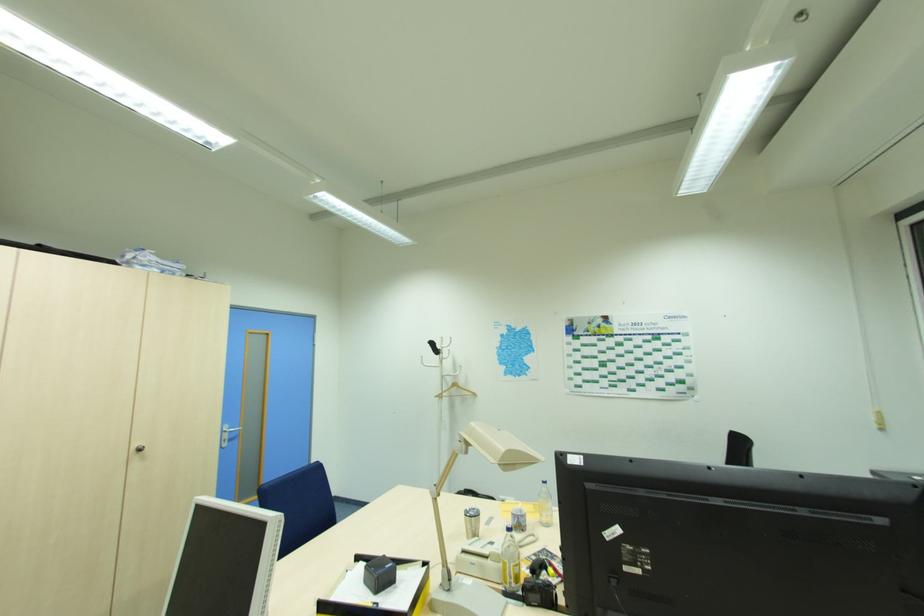
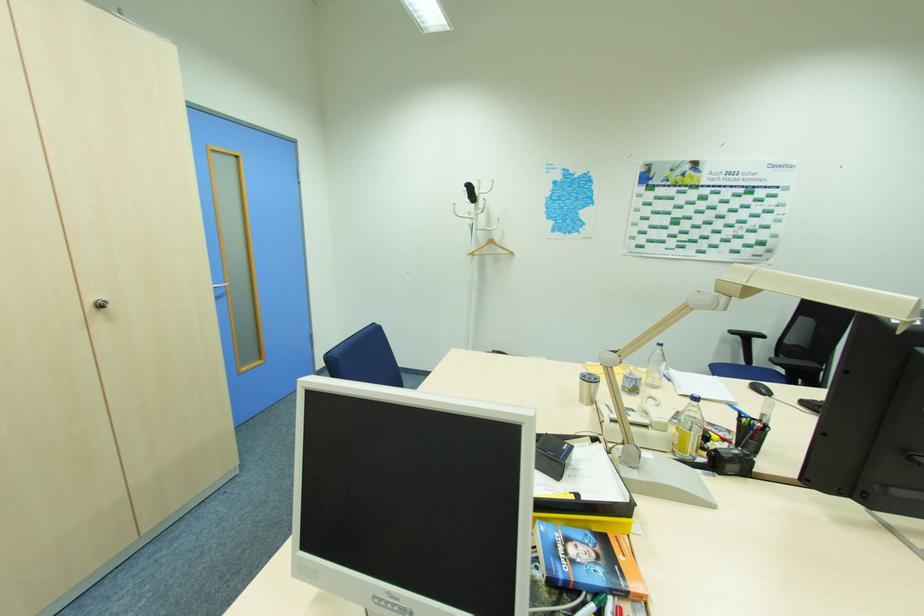
Locate, in the second image, the point that corresponds to the point at 140,450 in the first image.

(103, 306)